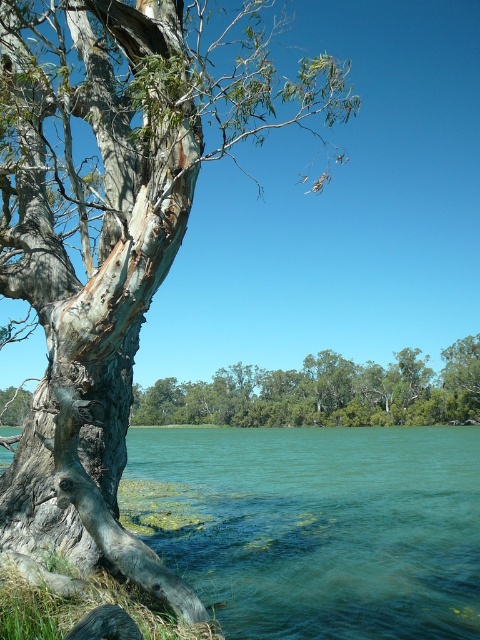
You are standing at the edge of the water in the scene. You see two points marked on the ground. The first point is labeled as point [316,552], and the second is point [313,403]. If you want to walk from the first point to the second point, will you need to walk towards the tree or away from it?

Since point [316,552] is in front of point [313,403], walking from the first point to the second point would require moving away from the tree.

You are standing at the point marked by coordinates point (315, 525) in the image. Looking around, you see greenish water at lower left. What is directly below you?

The point (315, 525) is located at greenish water at lower left, so the area directly below you is greenish water at lower left.